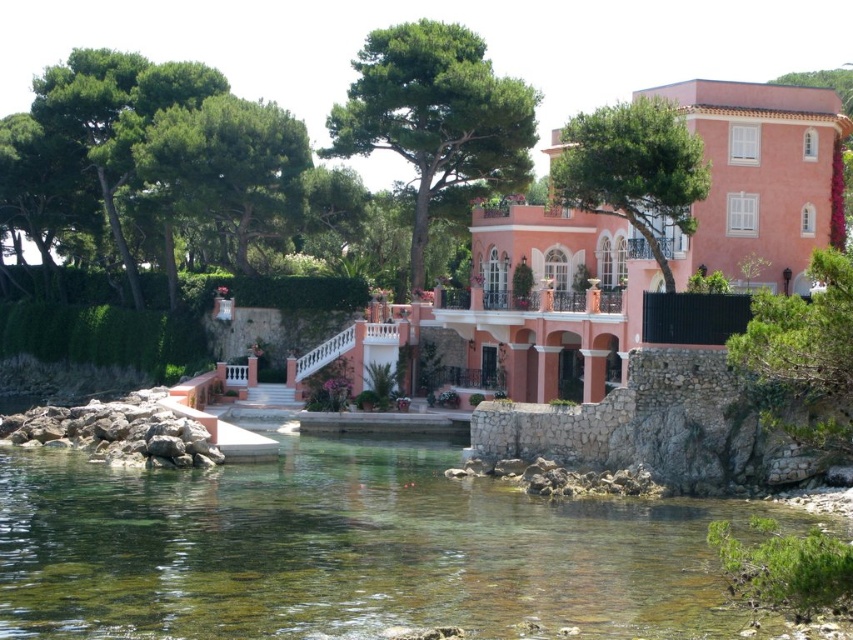
Consider the image. Who is shorter, clear water at lower center or pink stucco villa at center?

clear water at lower center

Which is behind, point (605, 552) or point (776, 141)?

Point (776, 141)

Does point (450, 522) lie in front of point (689, 260)?

Yes, point (450, 522) is in front of point (689, 260).

Where is `clear water at lower center`? The height and width of the screenshot is (640, 853). clear water at lower center is located at coordinates (347, 550).

Can you confirm if green leafy tree at upper left is thinner than green leafy tree at upper right?

Incorrect, green leafy tree at upper left's width is not less than green leafy tree at upper right's.

Can you confirm if green leafy tree at upper left is wider than green leafy tree at upper right?

Yes, green leafy tree at upper left is wider than green leafy tree at upper right.

You are a GUI agent. You are given a task and a screenshot of the screen. Output one action in this format:
    pyautogui.click(x=<x>, y=<y>)
    Task: Click on the green leafy tree at upper left
    
    Given the screenshot: What is the action you would take?
    pyautogui.click(x=115, y=115)

The height and width of the screenshot is (640, 853). I want to click on green leafy tree at upper left, so click(115, 115).

Can you confirm if green textured tree at right is bigger than green leafy tree at upper center?

Correct, green textured tree at right is larger in size than green leafy tree at upper center.

This screenshot has width=853, height=640. Describe the element at coordinates (802, 356) in the screenshot. I see `green textured tree at right` at that location.

Is point (773, 417) farther from camera compared to point (660, 125)?

No, it is not.

Where is `green textured tree at right`? Image resolution: width=853 pixels, height=640 pixels. green textured tree at right is located at coordinates (802, 356).